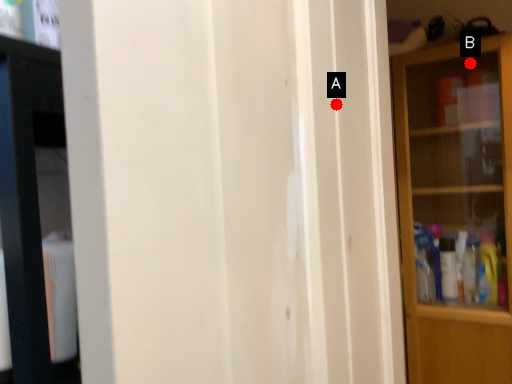
Question: Two points are circled on the image, labeled by A and B beside each circle. Which point is closer to the camera?

Choices:
 (A) A is closer
 (B) B is closer

Answer: (A)